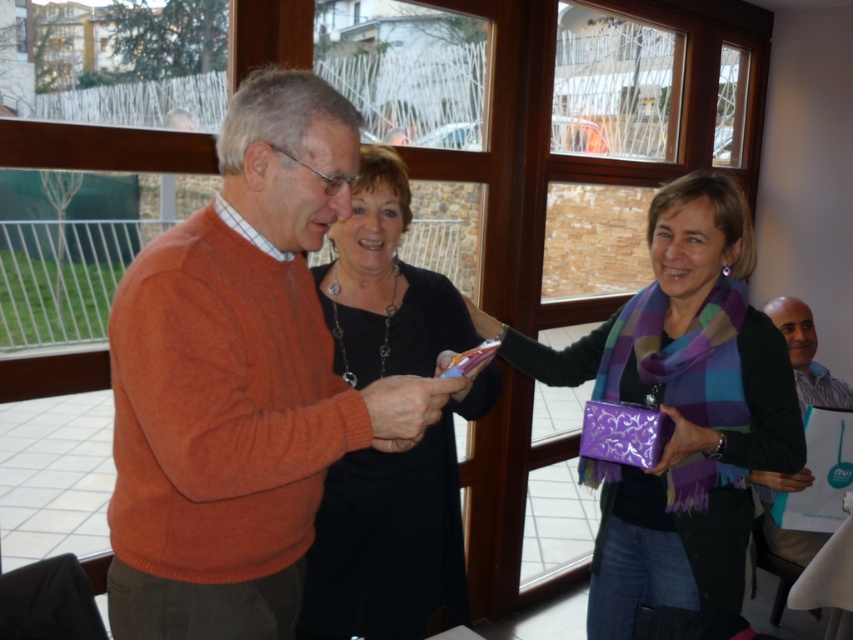
Question: Which of the following is the closest to the observer?

Choices:
 (A) striped shirt at right
 (B) purple shiny gift bag at center
 (C) black matte dress at center
 (D) matte purple gift bag at right

Answer: (C)

Question: Does matte purple gift bag at right have a larger size compared to black matte dress at center?

Choices:
 (A) yes
 (B) no

Answer: (A)

Question: Does matte purple gift bag at right appear over purple shiny gift bag at center?

Choices:
 (A) no
 (B) yes

Answer: (B)

Question: Which point appears farthest from the camera in this image?

Choices:
 (A) (357, 321)
 (B) (592, 456)
 (C) (682, 204)
 (D) (840, 394)

Answer: (D)

Question: Which of the following is the farthest from the observer?

Choices:
 (A) black matte dress at center
 (B) matte purple gift bag at right

Answer: (B)

Question: In this image, where is matte purple gift bag at right located relative to purple shiny gift bag at center?

Choices:
 (A) above
 (B) below

Answer: (A)